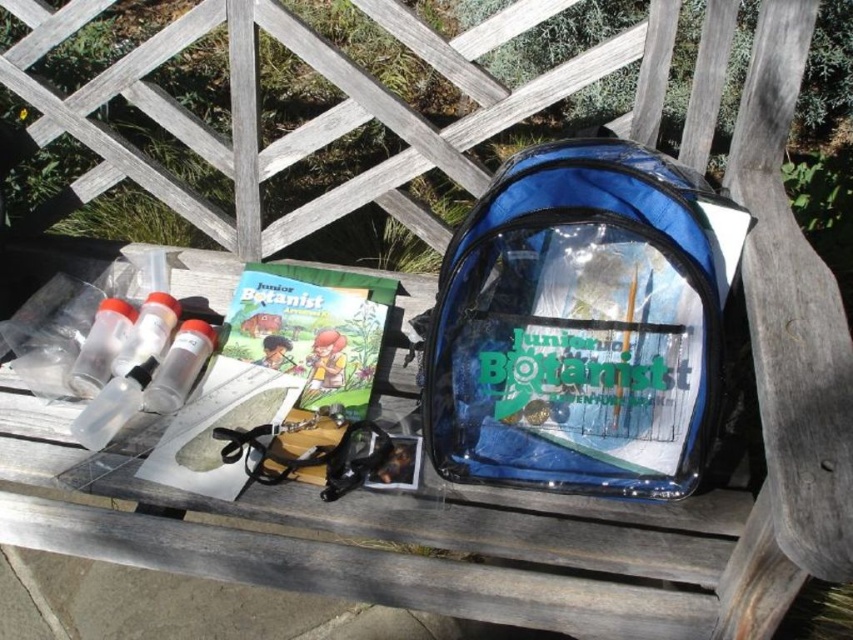
You are a junior botanist preparing for a field trip. You see the transparent blue backpack at center and the matte green book at center on the bench. Which item is positioned higher relative to the other?

The transparent blue backpack at center is above the matte green book at center, so it is positioned higher.

You are a junior botanist sitting on the bench and want to reach both the point at (424, 355) and the point at (199, 488). Which point should you reach for first if you want to pick up the items in the order they appear from your perspective?

You should reach for point (199, 488) first because it is in front of point (424, 355) from your perspective.

You are a junior botanist who needs to retrieve your tools from the transparent blue backpack at center. Your book, the matte green book at center, has important notes. Can you reach the backpack without moving the book if your arm can extend 12 inches?

The transparent blue backpack at center and the matte green book at center are 13.18 inches apart. Since your arm can only extend 12 inches, you cannot reach the backpack without moving the book.